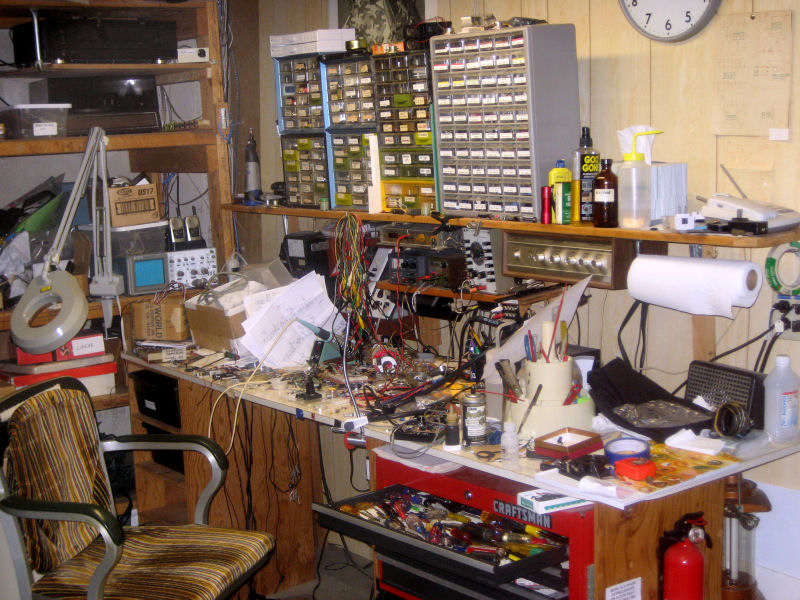
Find the location of a particular element. The height and width of the screenshot is (600, 800). cordless phone is located at coordinates (753, 208).